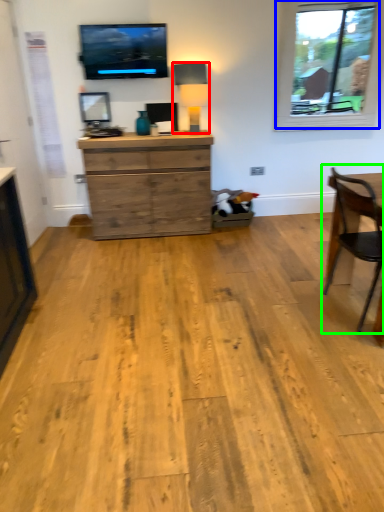
Question: Based on their relative distances, which object is farther from lamp (highlighted by a red box)? Choose from window (highlighted by a blue box) and chair (highlighted by a green box).

Choices:
 (A) window
 (B) chair

Answer: (B)